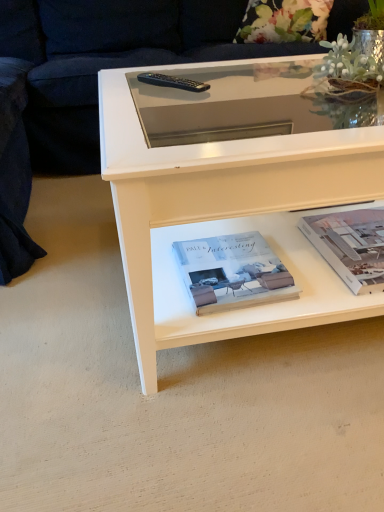
This screenshot has width=384, height=512. I want to click on vacant area on top of white paper at lower right, positioned as the first paperback book in right-to-left order (from a real-world perspective), so click(359, 239).